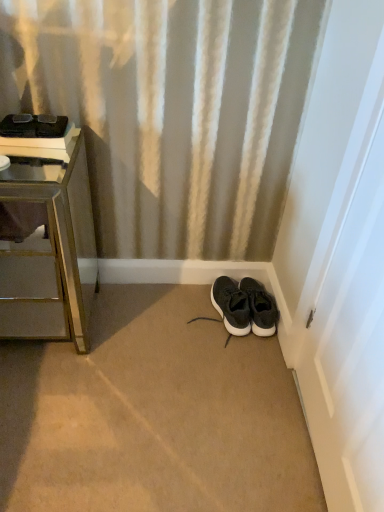
Locate an element on the screen. free region on the left part of white glossy door at right is located at coordinates (213, 431).